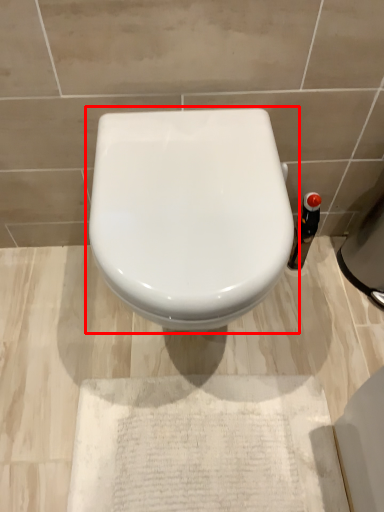
Question: In this image, where is toilet (annotated by the red box) located relative to bottle?

Choices:
 (A) left
 (B) right

Answer: (A)